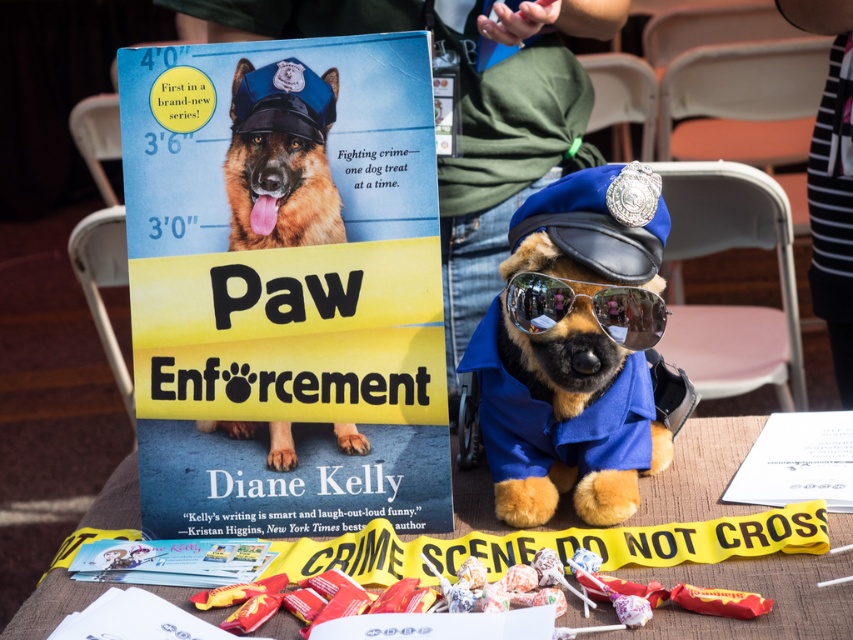
You are a photographer standing at a distance of 5 feet from the table. You want to take a closeup shot of the point at coordinates point (299, 216). Can you reach it without moving closer than your current position?

The distance of point (299, 216) from camera is 4.39 feet, so yes, you can reach it without moving closer since you are currently 5 feet away, which is farther than the required distance.

You are a detective examining the table setup. You notice the shiny brown fur at center and the reflective plastic goggles at center. Which object is positioned higher on the table?

The shiny brown fur at center is located above the reflective plastic goggles at center, so it is positioned higher on the table.

You are a detective examining the crime scene table. You need to determine which object is taller between the shiny brown fur at center and the matte plastic candy at lower center. Based on the scene, which one is taller?

The shiny brown fur at center is taller than the matte plastic candy at lower center according to the description.